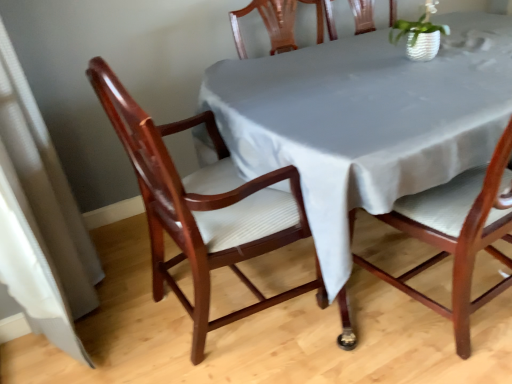
Question: From a real-world perspective, relative to white textured pot at upper right, is mahogany wood chair at center, which is the 1th chair in right-to-left order, vertically above or below?

Choices:
 (A) above
 (B) below

Answer: (B)

Question: Is mahogany wood chair at center, which is the 1th chair in right-to-left order, spatially inside white textured pot at upper right, or outside of it?

Choices:
 (A) inside
 (B) outside

Answer: (B)

Question: Which of these objects is positioned farthest from the mahogany wood chair at left, placed as the second chair when sorted from right to left?

Choices:
 (A) smooth gray tablecloth at center
 (B) white textured pot at upper right
 (C) mahogany wood chair at center, the second chair when ordered from left to right

Answer: (B)

Question: Considering the real-world distances, which object is farthest from the smooth gray tablecloth at center?

Choices:
 (A) mahogany wood chair at left, which is the 1th chair from left to right
 (B) mahogany wood chair at center, which is the 1th chair in right-to-left order
 (C) white textured pot at upper right

Answer: (C)